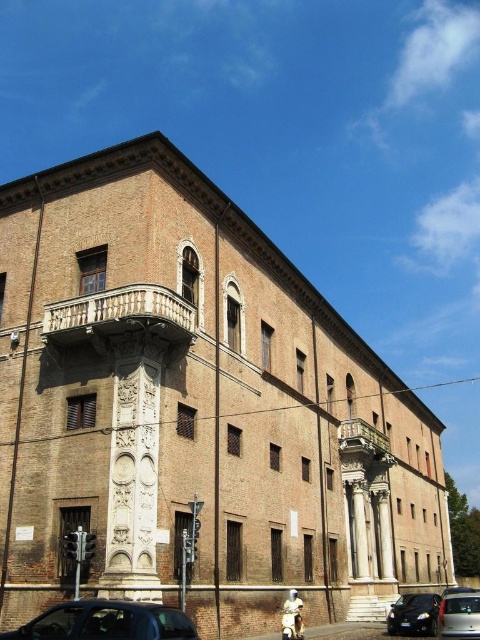
Question: Can you confirm if shiny black car at lower right is thinner than metallic silver van at lower right?

Choices:
 (A) yes
 (B) no

Answer: (B)

Question: Is shiny black car at lower right below metallic silver van at lower right?

Choices:
 (A) no
 (B) yes

Answer: (B)

Question: Which object is closer to the camera taking this photo?

Choices:
 (A) metallic silver van at lower right
 (B) shiny black car at lower right
 (C) shiny black car at lower left

Answer: (C)

Question: Observing the image, what is the correct spatial positioning of shiny black car at lower right in reference to metallic silver van at lower right?

Choices:
 (A) below
 (B) above

Answer: (A)

Question: Estimate the real-world distances between objects in this image. Which object is farther from the metallic silver van at lower right?

Choices:
 (A) shiny black car at lower left
 (B) shiny black car at lower right

Answer: (A)

Question: Among these points, which one is farthest from the camera?

Choices:
 (A) (406, 605)
 (B) (73, 602)
 (C) (454, 604)

Answer: (A)